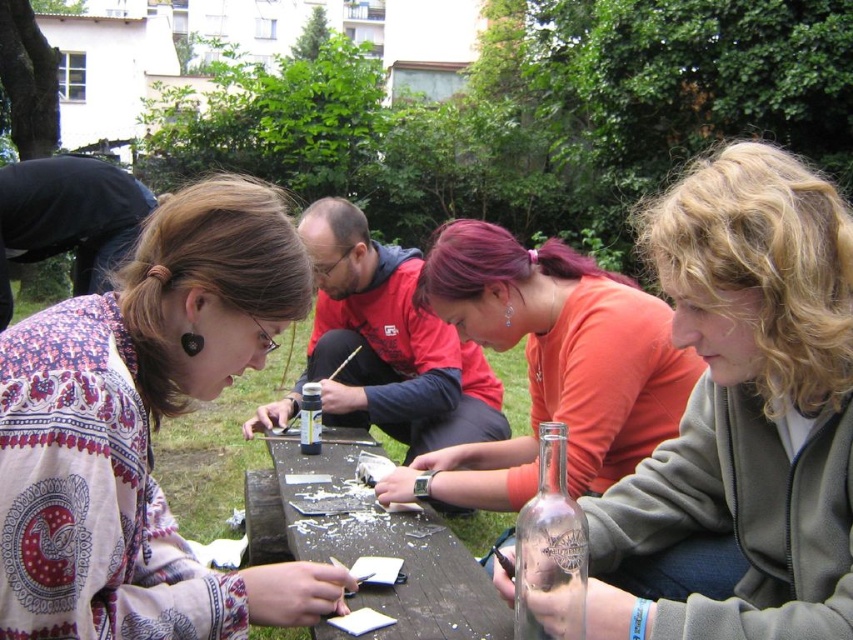
Question: Does wooden table at center appear under transparent glass bottle at center?

Choices:
 (A) no
 (B) yes

Answer: (B)

Question: Does orange cotton shirt at center have a larger size compared to transparent glass bottle at lower center?

Choices:
 (A) yes
 (B) no

Answer: (A)

Question: Is orange cotton shirt at center closer to camera compared to transparent glass bottle at lower center?

Choices:
 (A) no
 (B) yes

Answer: (A)

Question: Estimate the real-world distances between objects in this image. Which object is farther from the wooden table at center?

Choices:
 (A) transparent glass bottle at lower center
 (B) patterned fabric shirt at upper left
 (C) transparent glass bottle at center
 (D) translucent glass bottle at center

Answer: (A)

Question: Estimate the real-world distances between objects in this image. Which object is closer to the translucent glass bottle at center?

Choices:
 (A) patterned fabric shirt at upper left
 (B) orange cotton shirt at center
 (C) wooden table at center

Answer: (B)

Question: Based on their relative distances, which object is farther from the wooden table at center?

Choices:
 (A) orange cotton shirt at center
 (B) transparent glass bottle at lower center
 (C) transparent glass bottle at center
 (D) patterned fabric shirt at upper left

Answer: (B)